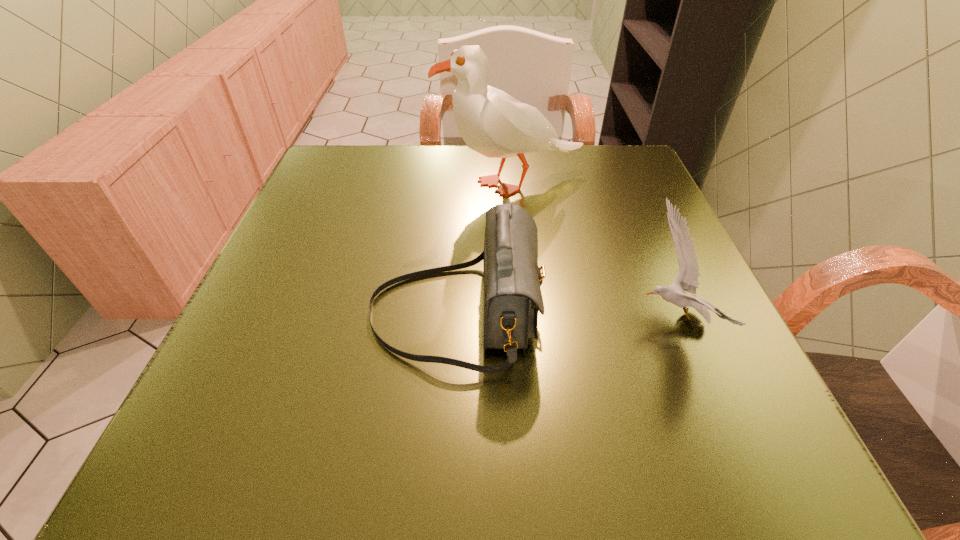
Locate an element on the screen. free space at the far right corner of the desktop is located at coordinates (641, 194).

Where is `free space between the rightmost object and the farther gull`? Image resolution: width=960 pixels, height=540 pixels. free space between the rightmost object and the farther gull is located at coordinates (593, 251).

You are a GUI agent. You are given a task and a screenshot of the screen. Output one action in this format:
    pyautogui.click(x=<x>, y=<y>)
    Task: Click on the vacant area between the right gull and the left gull
    
    Given the screenshot: What is the action you would take?
    pyautogui.click(x=593, y=251)

Find the location of a particular element. free point between the second tallest object and the nearer gull is located at coordinates (564, 315).

The image size is (960, 540). What are the coordinates of `free area in between the taller gull and the rightmost object` in the screenshot? It's located at (593, 251).

Locate an element on the screen. The width and height of the screenshot is (960, 540). blank region between the rightmost object and the taller gull is located at coordinates (593, 251).

Locate an element on the screen. free spot between the rightmost object and the tallest object is located at coordinates (593, 251).

This screenshot has height=540, width=960. I want to click on unoccupied position between the left gull and the shoulder bag, so click(484, 248).

Image resolution: width=960 pixels, height=540 pixels. What are the coordinates of `vacant area that lies between the second tallest object and the rightmost object` in the screenshot? It's located at (564, 315).

Locate an element on the screen. free spot between the second tallest object and the farthest object is located at coordinates (484, 248).